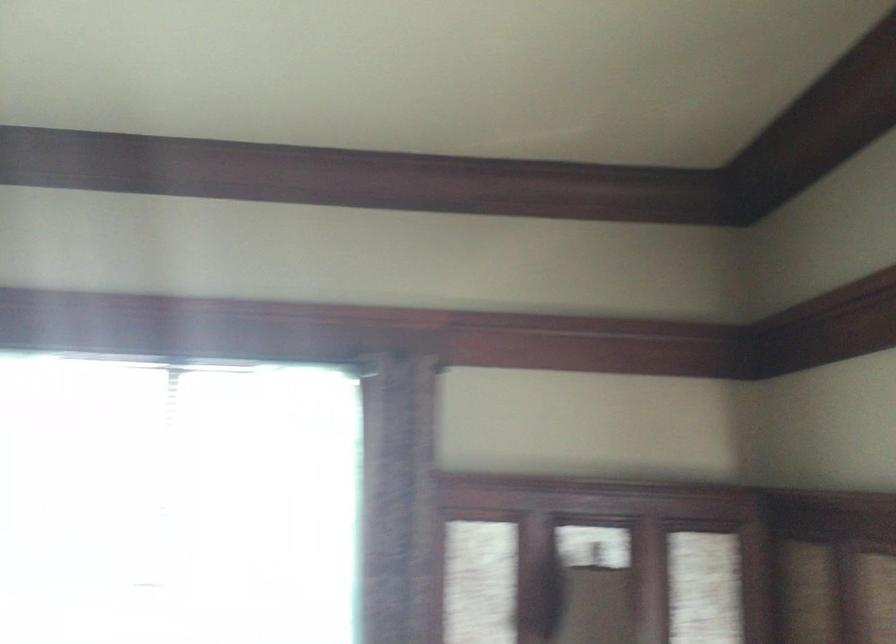
Question: The camera is either moving clockwise (left) or counter-clockwise (right) around the object. The first image is from the beginning of the video and the second image is from the end. Is the camera moving left or right when shooting the video?

Choices:
 (A) Left
 (B) Right

Answer: (A)